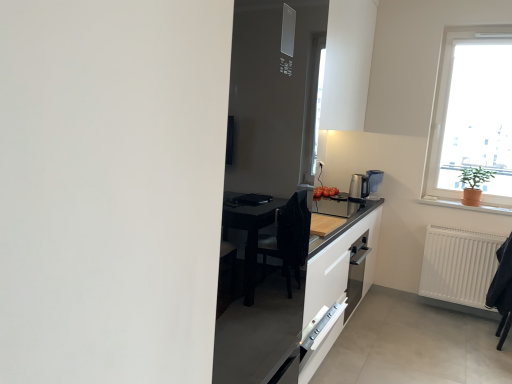
Question: Does satin silver coffee machine at right turn towards white plastic electric outlet at upper center?

Choices:
 (A) no
 (B) yes

Answer: (A)

Question: From a real-world perspective, is satin silver coffee machine at right under white plastic electric outlet at upper center?

Choices:
 (A) no
 (B) yes

Answer: (B)

Question: Considering the relative sizes of satin silver coffee machine at right and white plastic electric outlet at upper center in the image provided, is satin silver coffee machine at right bigger than white plastic electric outlet at upper center?

Choices:
 (A) yes
 (B) no

Answer: (A)

Question: From a real-world perspective, is satin silver coffee machine at right on white plastic electric outlet at upper center?

Choices:
 (A) no
 (B) yes

Answer: (A)

Question: From the image's perspective, does satin silver coffee machine at right appear higher than white plastic electric outlet at upper center?

Choices:
 (A) yes
 (B) no

Answer: (B)

Question: Is satin silver coffee machine at right not within white plastic electric outlet at upper center?

Choices:
 (A) yes
 (B) no

Answer: (A)

Question: Is green matte plant at upper right at the left side of satin silver coffee machine at right?

Choices:
 (A) no
 (B) yes

Answer: (A)

Question: Is green matte plant at upper right aimed at satin silver coffee machine at right?

Choices:
 (A) yes
 (B) no

Answer: (B)

Question: Does green matte plant at upper right appear on the right side of satin silver coffee machine at right?

Choices:
 (A) yes
 (B) no

Answer: (A)

Question: From the image's perspective, does green matte plant at upper right appear higher than satin silver coffee machine at right?

Choices:
 (A) no
 (B) yes

Answer: (B)

Question: Can you see green matte plant at upper right touching satin silver coffee machine at right?

Choices:
 (A) yes
 (B) no

Answer: (B)

Question: Does green matte plant at upper right have a larger size compared to satin silver coffee machine at right?

Choices:
 (A) no
 (B) yes

Answer: (B)

Question: Can you confirm if orange clay pot at right is smaller than satin silver coffee machine at right?

Choices:
 (A) yes
 (B) no

Answer: (A)